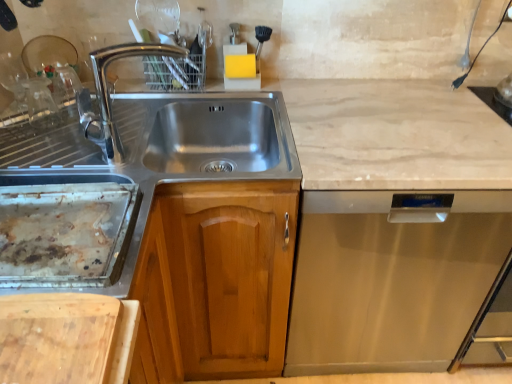
Question: Is wooden cutting board at lower left in contact with chrome metallic faucet at upper left?

Choices:
 (A) no
 (B) yes

Answer: (A)

Question: From the image's perspective, is wooden cutting board at lower left under chrome metallic faucet at upper left?

Choices:
 (A) no
 (B) yes

Answer: (B)

Question: Considering the relative sizes of wooden cutting board at lower left and chrome metallic faucet at upper left in the image provided, is wooden cutting board at lower left shorter than chrome metallic faucet at upper left?

Choices:
 (A) no
 (B) yes

Answer: (B)

Question: Can you confirm if wooden cutting board at lower left is thinner than chrome metallic faucet at upper left?

Choices:
 (A) no
 (B) yes

Answer: (A)

Question: Is wooden cutting board at lower left turned away from chrome metallic faucet at upper left?

Choices:
 (A) yes
 (B) no

Answer: (B)

Question: Which is correct: chrome metallic faucet at upper left is inside wooden cutting board at lower left, or outside of it?

Choices:
 (A) inside
 (B) outside

Answer: (B)

Question: Is chrome metallic faucet at upper left wider or thinner than wooden cutting board at lower left?

Choices:
 (A) wide
 (B) thin

Answer: (B)

Question: Relative to wooden cutting board at lower left, is chrome metallic faucet at upper left in front or behind?

Choices:
 (A) behind
 (B) front

Answer: (A)

Question: From the image's perspective, is chrome metallic faucet at upper left located above or below wooden cutting board at lower left?

Choices:
 (A) below
 (B) above

Answer: (B)

Question: From the image's perspective, is wooden cutting board at lower left located above or below chrome metallic faucet at upper left?

Choices:
 (A) below
 (B) above

Answer: (A)

Question: Choose the correct answer: Is wooden cutting board at lower left inside chrome metallic faucet at upper left or outside it?

Choices:
 (A) outside
 (B) inside

Answer: (A)

Question: Is wooden cutting board at lower left taller or shorter than chrome metallic faucet at upper left?

Choices:
 (A) tall
 (B) short

Answer: (B)

Question: From a real-world perspective, relative to chrome metallic faucet at upper left, is wooden cutting board at lower left vertically above or below?

Choices:
 (A) below
 (B) above

Answer: (A)

Question: Considering the positions of point (259, 324) and point (30, 327), is point (259, 324) closer or farther from the camera than point (30, 327)?

Choices:
 (A) farther
 (B) closer

Answer: (A)

Question: Looking at their shapes, would you say wooden cabinet at center is wider or thinner than wooden cutting board at lower left?

Choices:
 (A) wide
 (B) thin

Answer: (A)